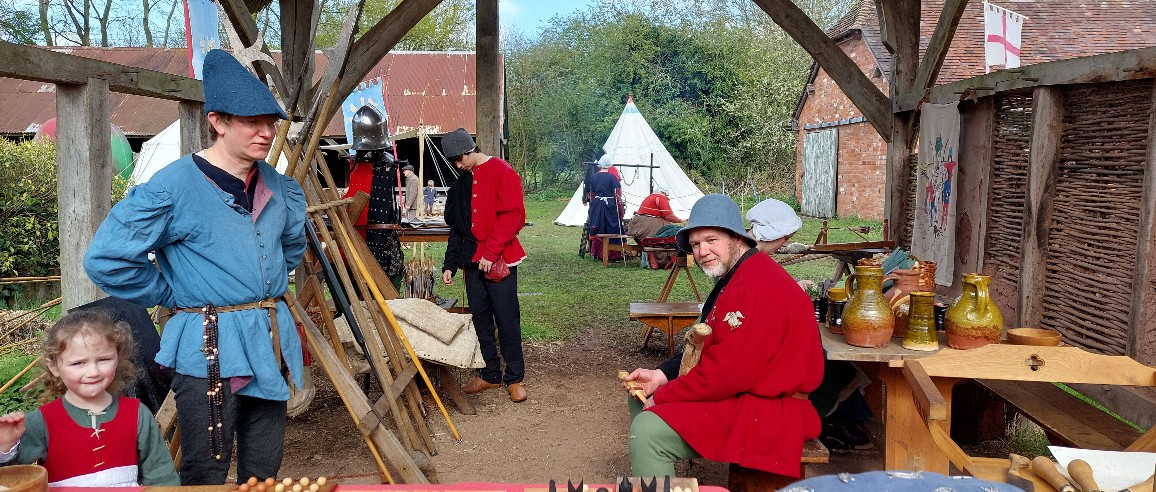
Identify the location of pottery on table, clay, brown. This screenshot has height=492, width=1156. (879, 310), (959, 316), (944, 281).